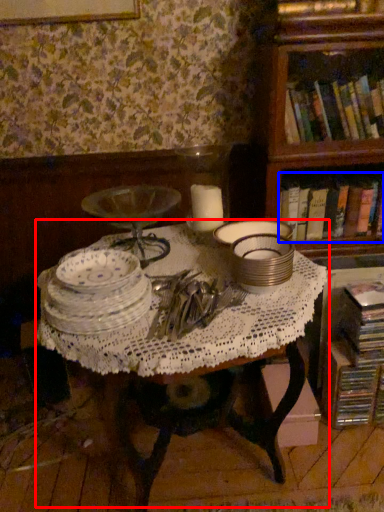
Question: Which object is closer to the camera taking this photo, table (highlighted by a red box) or book (highlighted by a blue box)?

Choices:
 (A) table
 (B) book

Answer: (A)